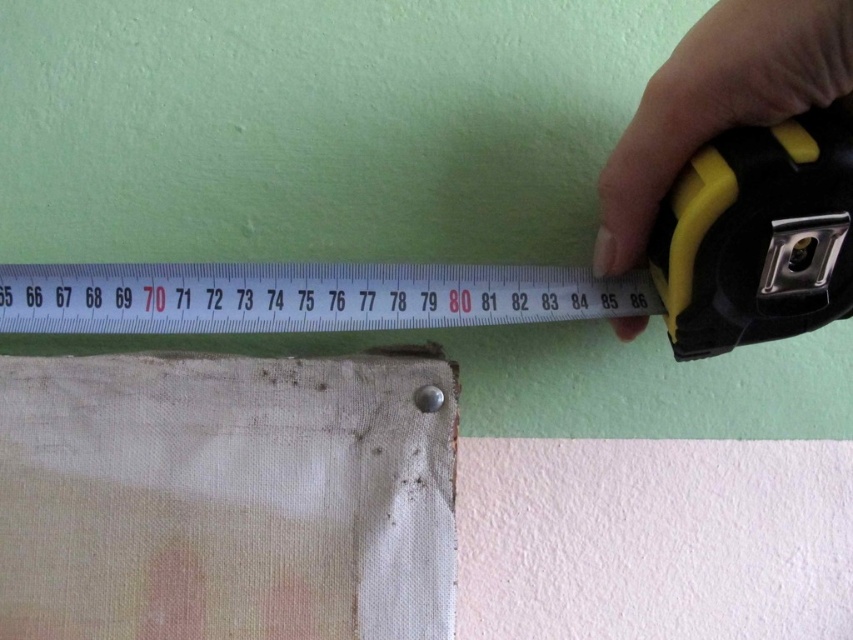
Which is behind, point (84, 529) or point (338, 269)?

Point (338, 269)

Who is lower down, white fabric pocket at lower left or white plastic ruler at upper center?

white fabric pocket at lower left

Who is more forward, (314, 568) or (302, 310)?

Point (314, 568) is in front.

Identify the location of white fabric pocket at lower left. (225, 497).

Is white fabric pocket at lower left shorter than yellow rubber tape measure at upper right?

Indeed, white fabric pocket at lower left has a lesser height compared to yellow rubber tape measure at upper right.

Locate an element on the screen. This screenshot has height=640, width=853. white fabric pocket at lower left is located at coordinates (225, 497).

The height and width of the screenshot is (640, 853). Find the location of `white fabric pocket at lower left`. white fabric pocket at lower left is located at coordinates (225, 497).

Which of these two, white plastic ruler at upper center or yellow rubber tape measure at upper right, stands taller?

Standing taller between the two is yellow rubber tape measure at upper right.

The height and width of the screenshot is (640, 853). What do you see at coordinates (305, 296) in the screenshot?
I see `white plastic ruler at upper center` at bounding box center [305, 296].

The height and width of the screenshot is (640, 853). What are the coordinates of `white plastic ruler at upper center` in the screenshot? It's located at (305, 296).